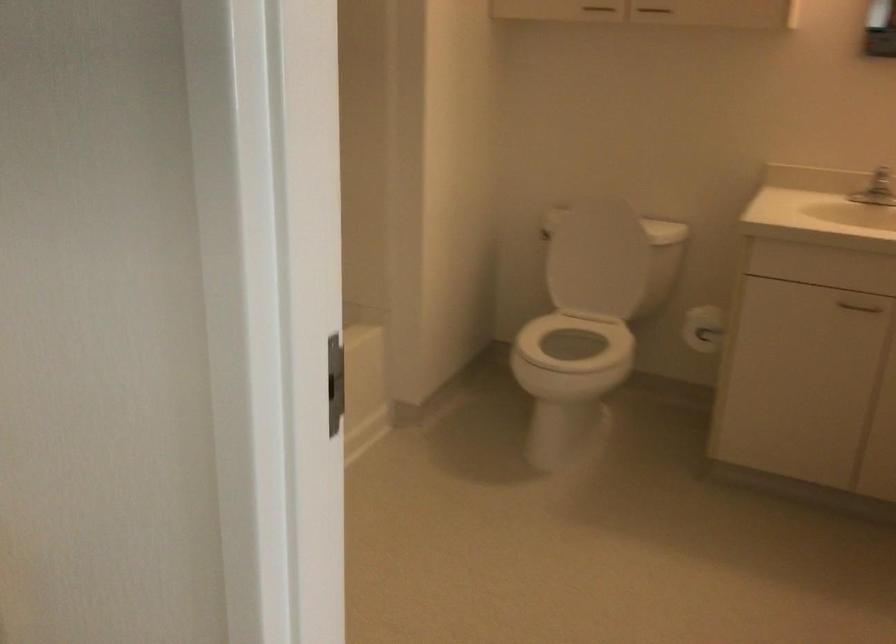
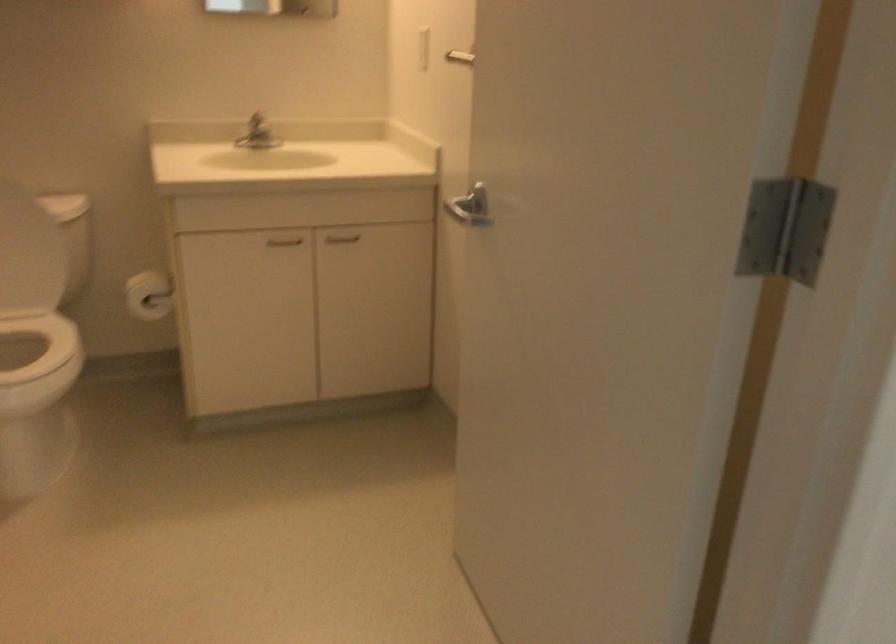
Find the pixel in the second image that matches [696,333] in the first image.

(149, 295)